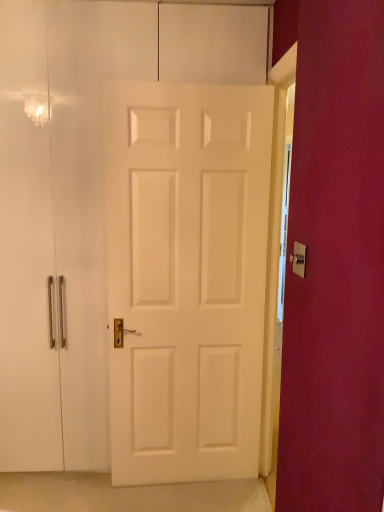
Question: Considering the relative sizes of white matte door at center and gold metallic door handle at center in the image provided, is white matte door at center wider than gold metallic door handle at center?

Choices:
 (A) no
 (B) yes

Answer: (B)

Question: From a real-world perspective, is white matte door at center positioned over gold metallic door handle at center based on gravity?

Choices:
 (A) yes
 (B) no

Answer: (B)

Question: Is gold metallic door handle at center at the back of white matte door at center?

Choices:
 (A) no
 (B) yes

Answer: (A)

Question: Is there a large distance between white matte door at center and gold metallic door handle at center?

Choices:
 (A) no
 (B) yes

Answer: (B)

Question: Is the position of white matte door at center less distant than that of gold metallic door handle at center?

Choices:
 (A) no
 (B) yes

Answer: (A)

Question: Is white matte door at center shorter than gold metallic door handle at center?

Choices:
 (A) no
 (B) yes

Answer: (A)

Question: Is gold metallic door handle at center next to white matte door at center and touching it?

Choices:
 (A) yes
 (B) no

Answer: (B)

Question: Considering the relative positions of gold metallic door handle at center and white matte door at center in the image provided, is gold metallic door handle at center in front of white matte door at center?

Choices:
 (A) yes
 (B) no

Answer: (A)

Question: Is gold metallic door handle at center positioned beyond the bounds of white matte door at center?

Choices:
 (A) no
 (B) yes

Answer: (B)

Question: Can you confirm if gold metallic door handle at center is wider than white matte door at center?

Choices:
 (A) yes
 (B) no

Answer: (B)

Question: Does gold metallic door handle at center have a larger size compared to white matte door at center?

Choices:
 (A) no
 (B) yes

Answer: (A)

Question: Is gold metallic door handle at center further to the viewer compared to white matte door at center?

Choices:
 (A) yes
 (B) no

Answer: (B)

Question: Is gold metallic door handle at center wider or thinner than white matte door at center?

Choices:
 (A) wide
 (B) thin

Answer: (B)